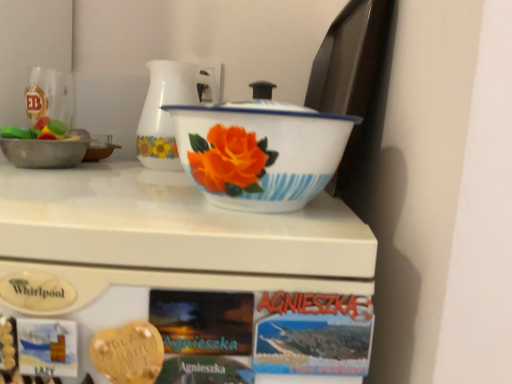
Locate an element on the screen. The image size is (512, 384). vacant space underneath white enamel basin at center (from a real-world perspective) is located at coordinates (264, 217).